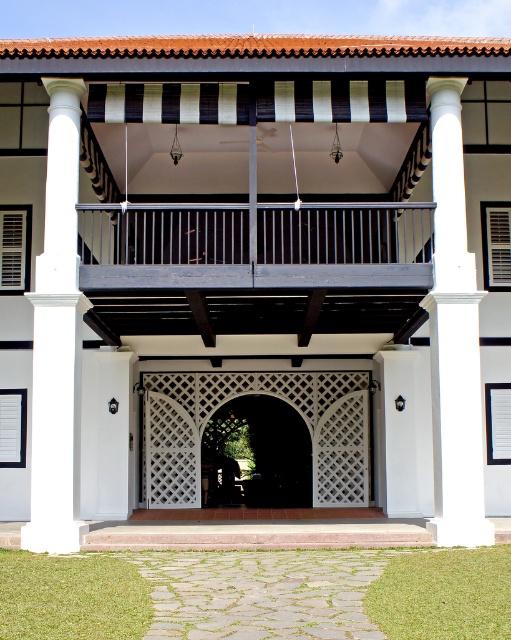
Question: Does dark gray metal railing at upper center lie in front of white lattice gate at center?

Choices:
 (A) no
 (B) yes

Answer: (B)

Question: Can you confirm if white smooth column at left is smaller than white lattice gate at center?

Choices:
 (A) yes
 (B) no

Answer: (A)

Question: Which point is closer to the camera?

Choices:
 (A) dark gray metal railing at upper center
 (B) dark wood lattice door at center
 (C) white smooth column at center
 (D) white smooth column at left

Answer: (C)

Question: Which object appears farthest from the camera in this image?

Choices:
 (A) white lattice gate at center
 (B) white smooth column at center
 (C) dark gray metal railing at upper center
 (D) white smooth column at left

Answer: (A)

Question: Which of these objects is positioned closest to the white lattice gate at center?

Choices:
 (A) white smooth column at center
 (B) dark wood lattice door at center
 (C) white smooth column at left

Answer: (B)

Question: In this image, where is white lattice gate at center located relative to dark wood lattice door at center?

Choices:
 (A) left
 (B) right

Answer: (A)